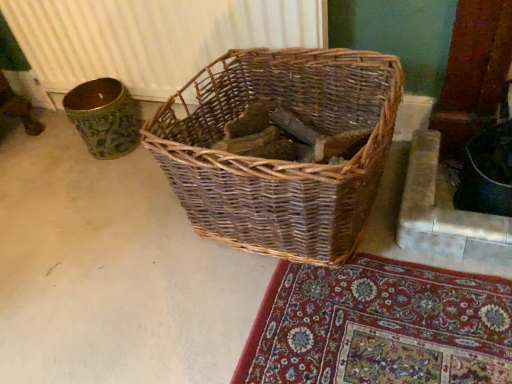
Question: Can you confirm if woven brown basket at center is taller than white textured radiator at upper center?

Choices:
 (A) yes
 (B) no

Answer: (B)

Question: Can you confirm if woven brown basket at center is wider than white textured radiator at upper center?

Choices:
 (A) yes
 (B) no

Answer: (A)

Question: Does woven brown basket at center appear on the left side of white textured radiator at upper center?

Choices:
 (A) no
 (B) yes

Answer: (A)

Question: Does woven brown basket at center have a lesser width compared to white textured radiator at upper center?

Choices:
 (A) no
 (B) yes

Answer: (A)

Question: Is woven brown basket at center far away from white textured radiator at upper center?

Choices:
 (A) yes
 (B) no

Answer: (B)

Question: From the image's perspective, is woven brown basket at center on white textured radiator at upper center?

Choices:
 (A) no
 (B) yes

Answer: (A)

Question: Could you tell me if white textured radiator at upper center is facing woven brown basket at center?

Choices:
 (A) yes
 (B) no

Answer: (A)

Question: Is white textured radiator at upper center positioned before woven brown basket at center?

Choices:
 (A) yes
 (B) no

Answer: (B)

Question: From a real-world perspective, is white textured radiator at upper center beneath woven brown basket at center?

Choices:
 (A) no
 (B) yes

Answer: (A)

Question: From the image's perspective, does white textured radiator at upper center appear lower than woven brown basket at center?

Choices:
 (A) no
 (B) yes

Answer: (A)

Question: Does white textured radiator at upper center have a lesser width compared to woven brown basket at center?

Choices:
 (A) yes
 (B) no

Answer: (A)

Question: Is white textured radiator at upper center smaller than woven brown basket at center?

Choices:
 (A) yes
 (B) no

Answer: (A)

Question: Considering the positions of point (131, 11) and point (348, 102), is point (131, 11) closer or farther from the camera than point (348, 102)?

Choices:
 (A) farther
 (B) closer

Answer: (A)